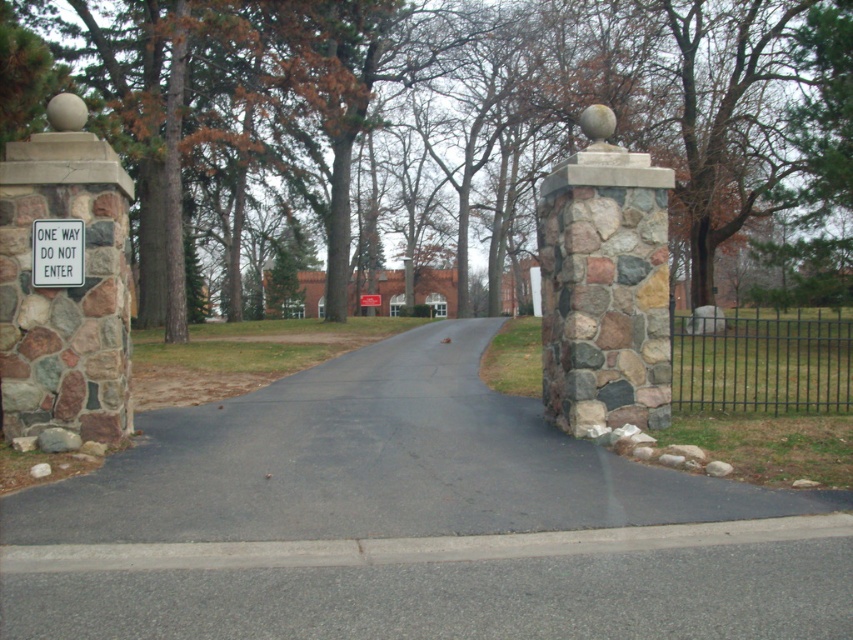
You are standing at the entrance of the driveway and want to walk directly towards the building. Which direction should you head relative to the point labeled as point (374,464)?

The black asphalt road at center is represented by point (374,464), so you should walk towards that point to reach the building.

You are driving a car and see both the white plastic sign at center and the white paper sign at center ahead on the driveway. Which sign will you reach first?

The white plastic sign at center will be reached first because it is closer to the viewer than the white paper sign at center.

You are driving a delivery truck that is 15 feet long. You need to pass through the driveway between the two signs. Can your truck fit between the white plastic sign at center and the white paper sign at center?

The white plastic sign at center and white paper sign at center are 156.89 feet apart. Since the truck is only 15 feet long, there is more than enough space for the truck to fit between the two signs.